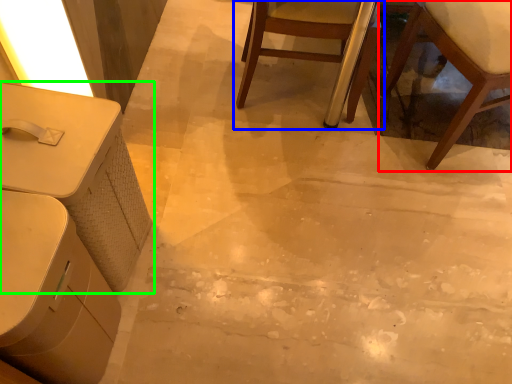
Question: Based on their relative distances, which object is nearer to chair (highlighted by a red box)? Choose from chair (highlighted by a blue box) and table (highlighted by a green box).

Choices:
 (A) chair
 (B) table

Answer: (A)